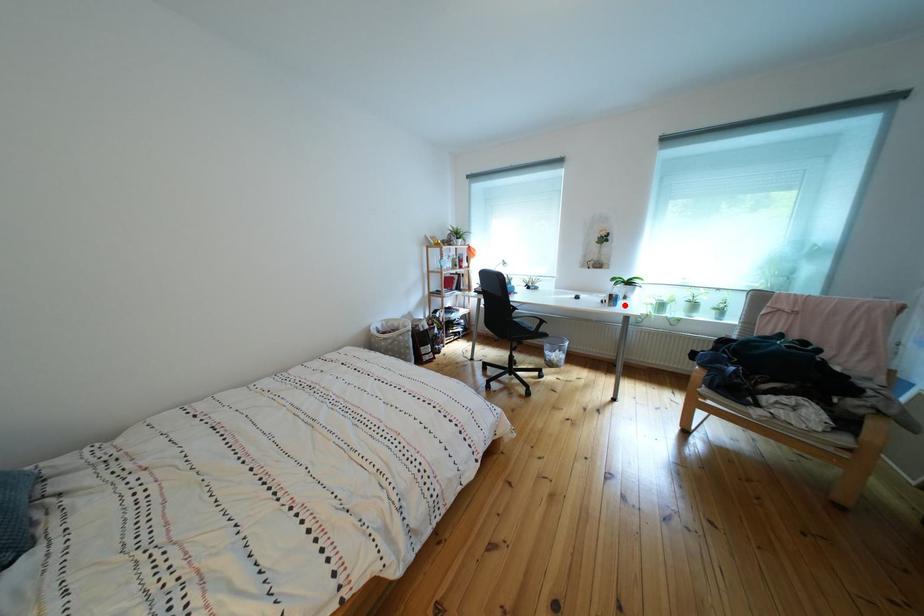
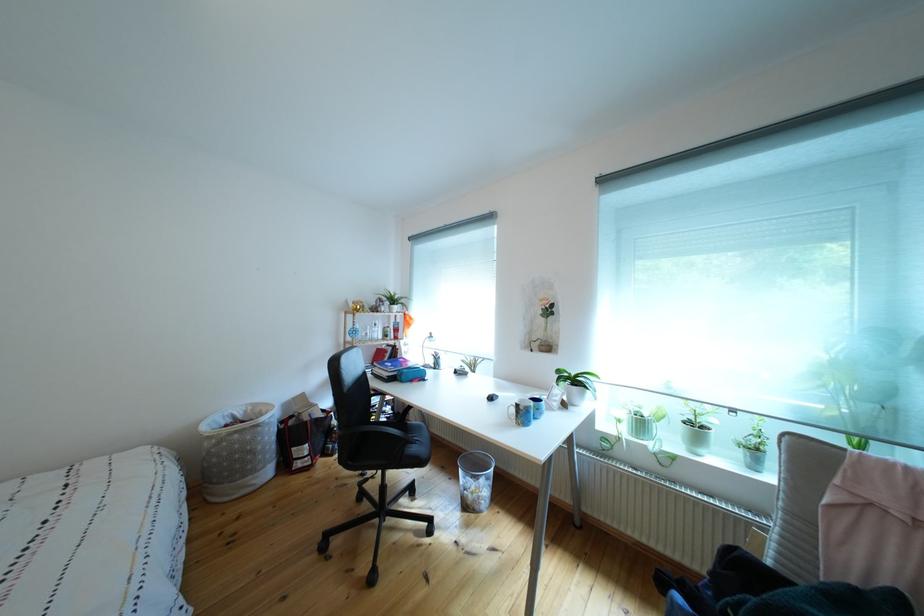
Question: I am providing you with two images of the same scene from different viewpoints. In image1, a red point is highlighted. Considering the same 3D point in image2, which of the following is correct?

Choices:
 (A) It is closer
 (B) It is farther

Answer: (B)